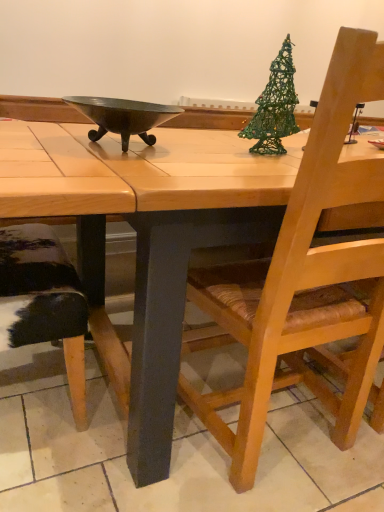
Question: Can you confirm if green wire christmas tree at upper right is wider than metallic dark gray bowl at center?

Choices:
 (A) no
 (B) yes

Answer: (A)

Question: Can we say green wire christmas tree at upper right lies outside metallic dark gray bowl at center?

Choices:
 (A) no
 (B) yes

Answer: (B)

Question: Is green wire christmas tree at upper right shorter than metallic dark gray bowl at center?

Choices:
 (A) no
 (B) yes

Answer: (A)

Question: Could metallic dark gray bowl at center be considered to be inside green wire christmas tree at upper right?

Choices:
 (A) no
 (B) yes

Answer: (A)

Question: Is green wire christmas tree at upper right facing towards metallic dark gray bowl at center?

Choices:
 (A) no
 (B) yes

Answer: (A)

Question: From the image's perspective, is wooden table at center positioned above or below green wire christmas tree at upper right?

Choices:
 (A) above
 (B) below

Answer: (B)

Question: Is wooden table at center taller or shorter than green wire christmas tree at upper right?

Choices:
 (A) short
 (B) tall

Answer: (B)

Question: From a real-world perspective, relative to green wire christmas tree at upper right, is wooden table at center vertically above or below?

Choices:
 (A) below
 (B) above

Answer: (A)

Question: Is wooden table at center inside or outside of green wire christmas tree at upper right?

Choices:
 (A) inside
 (B) outside

Answer: (B)

Question: In terms of height, does wooden chair with woven seat at right look taller or shorter compared to green wire christmas tree at upper right?

Choices:
 (A) short
 (B) tall

Answer: (B)

Question: In terms of width, does wooden chair with woven seat at right look wider or thinner when compared to green wire christmas tree at upper right?

Choices:
 (A) wide
 (B) thin

Answer: (A)

Question: Is wooden chair with woven seat at right to the left or to the right of green wire christmas tree at upper right in the image?

Choices:
 (A) right
 (B) left

Answer: (A)

Question: Considering the positions of point (249, 317) and point (266, 130), is point (249, 317) closer or farther from the camera than point (266, 130)?

Choices:
 (A) farther
 (B) closer

Answer: (B)

Question: Based on their sizes in the image, would you say metallic dark gray bowl at center is bigger or smaller than green wire christmas tree at upper right?

Choices:
 (A) big
 (B) small

Answer: (B)

Question: Is metallic dark gray bowl at center to the left or to the right of green wire christmas tree at upper right in the image?

Choices:
 (A) left
 (B) right

Answer: (A)